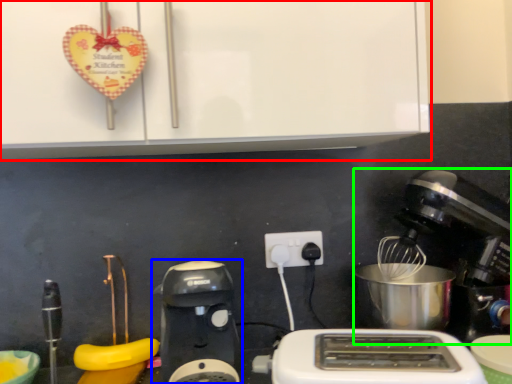
Question: Considering the real-world distances, which object is farthest from cabinetry (highlighted by a red box)? coffee maker (highlighted by a blue box) or mixer (highlighted by a green box)?

Choices:
 (A) coffee maker
 (B) mixer

Answer: (B)